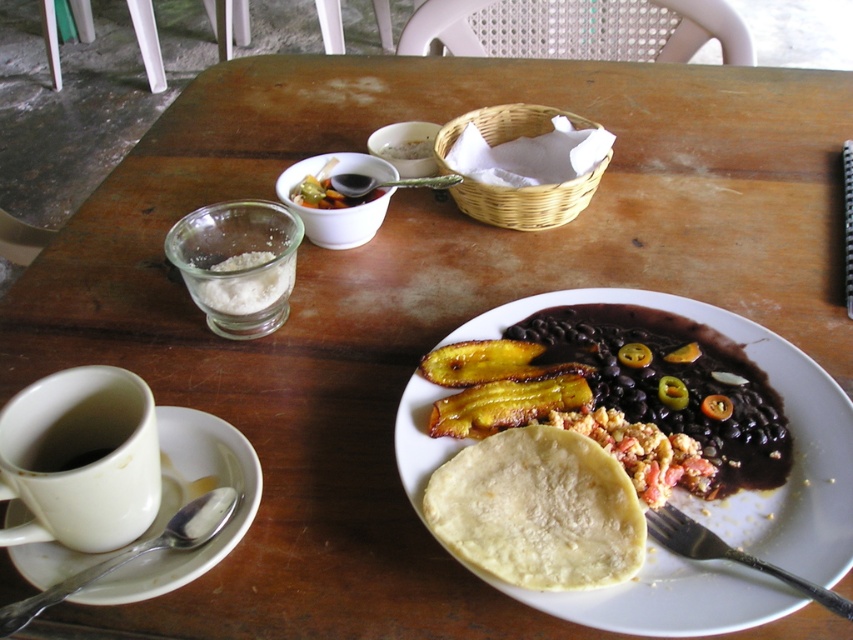
You are setting up a small tray for a meal. You have a white ceramic cup at lower left and a black metal fork at lower right. If you need to place them on the tray so that the wider item is on the left side of the tray, which object should you place on the left?

The white ceramic cup at lower left is wider than the black metal fork at lower right, so you should place the white ceramic cup at lower left on the left side of the tray.

You are a photographer adjusting your camera focus. You have two points in your viewfinder labeled as point 1 and point 2. Point 1 is at coordinates (x=213, y=516) and point 2 is at (x=230, y=301). Which point should you focus on first if you want to capture the closest object to the camera in this rustic dining scene?

Point 1 at coordinates (x=213, y=516) is closer to the viewer than point 2 at (x=230, y=301), so you should focus on point 1 first to capture the closest object.

You are standing 20 inches away from the dining table. There is a point at coordinates point (173, 580). Can you reach this point without moving closer to the table?

The distance of point (173, 580) from viewer is 17.90 inches, so yes, you can reach it without moving closer since you are already 20 inches away, which is farther than the point.